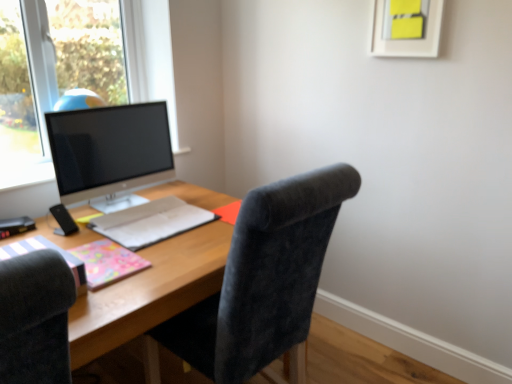
Question: From a real-world perspective, is matte gray notebook at center, which ranks as the third notebook in front-to-back order, physically located above or below pink glossy notebook at lower left, marked as the second notebook in a front-to-back arrangement?

Choices:
 (A) above
 (B) below

Answer: (B)

Question: Would you say matte gray notebook at center, which is the first notebook from back to front, is inside or outside pink glossy notebook at lower left, marked as the second notebook in a front-to-back arrangement?

Choices:
 (A) outside
 (B) inside

Answer: (A)

Question: Based on their relative distances, which object is nearer to the yellow paper at upper center?

Choices:
 (A) matte pink notebook at left, which is the third notebook in back-to-front order
 (B) satin black monitor at left
 (C) matte gray notebook at center, which is the first notebook from back to front
 (D) wooden desk at center
 (E) velvet dark gray chair at center

Answer: (E)

Question: Which is farther from the matte pink notebook at left, which is the third notebook in back-to-front order?

Choices:
 (A) pink glossy notebook at lower left, marked as the second notebook in a front-to-back arrangement
 (B) velvet dark gray chair at center
 (C) yellow paper at upper center
 (D) wooden desk at center
 (E) satin black monitor at left

Answer: (C)